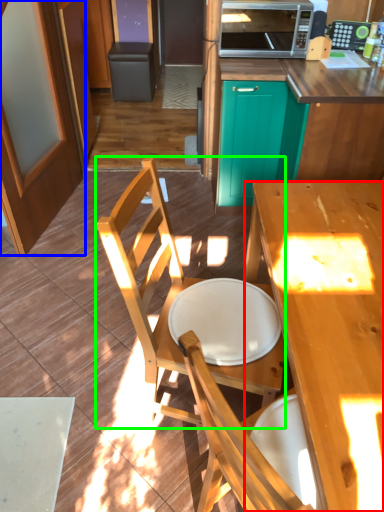
Question: Which object is positioned farthest from desk (highlighted by a red box)? Select from screen door (highlighted by a blue box) and chair (highlighted by a green box).

Choices:
 (A) screen door
 (B) chair

Answer: (A)